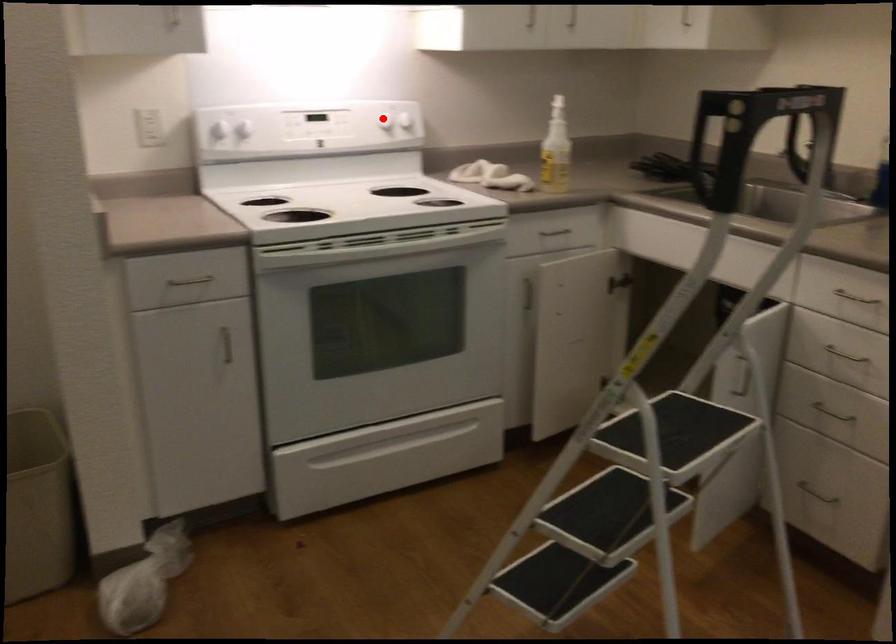
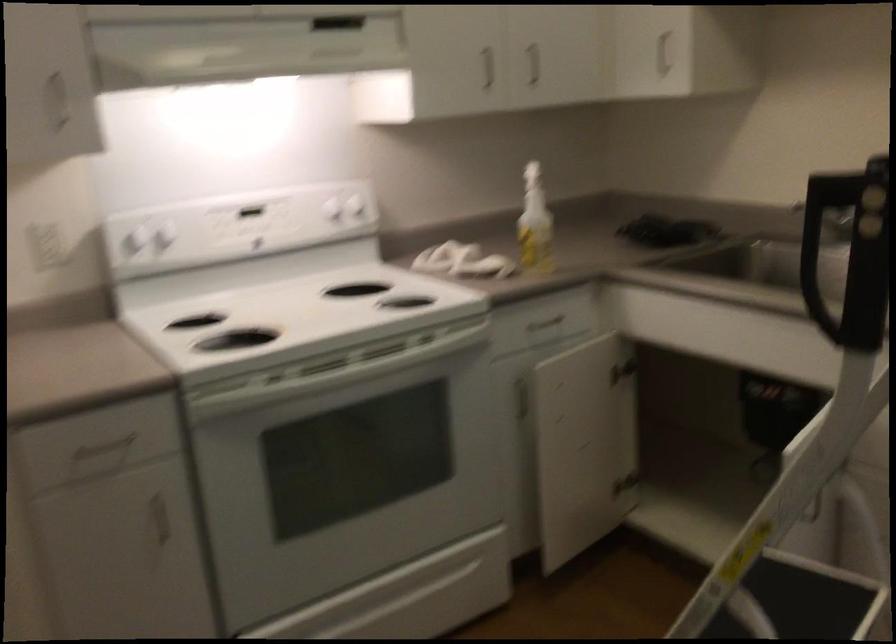
Question: I am providing you with two images of the same scene from different viewpoints. In image1, a red point is highlighted. Considering the same 3D point in image2, which of the following is correct?

Choices:
 (A) It is closer
 (B) It is farther

Answer: (A)